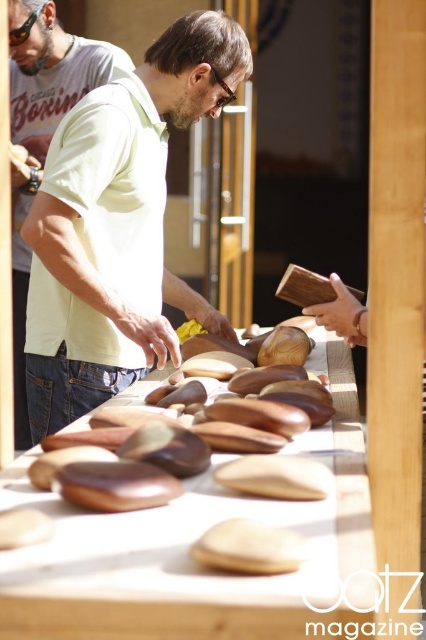
Does matte green shirt at center come in front of wooden table at center?

No, it is not.

Is matte green shirt at center to the right of wooden table at center from the viewer's perspective?

Incorrect, matte green shirt at center is not on the right side of wooden table at center.

Is point (86, 275) positioned behind point (178, 502)?

Yes, it is.

At what (x,y) coordinates should I click in order to perform the action: click on matte green shirt at center. Please return your answer as a coordinate pair (x, y). The height and width of the screenshot is (640, 426). Looking at the image, I should click on (118, 225).

Can you confirm if wooden table at center is positioned below matte yellow shirt at center?

Indeed, wooden table at center is positioned under matte yellow shirt at center.

Who is more distant from viewer, (360, 464) or (57, 92)?

Positioned behind is point (57, 92).

Which is in front, point (85, 566) or point (37, 49)?

Positioned in front is point (85, 566).

Image resolution: width=426 pixels, height=640 pixels. I want to click on wooden table at center, so click(189, 556).

This screenshot has width=426, height=640. Describe the element at coordinates (118, 225) in the screenshot. I see `matte green shirt at center` at that location.

Does matte green shirt at center have a smaller size compared to matte yellow shirt at center?

Indeed, matte green shirt at center has a smaller size compared to matte yellow shirt at center.

Who is more distant from viewer, (198, 22) or (37, 38)?

Positioned behind is point (37, 38).

The image size is (426, 640). I want to click on matte green shirt at center, so click(x=118, y=225).